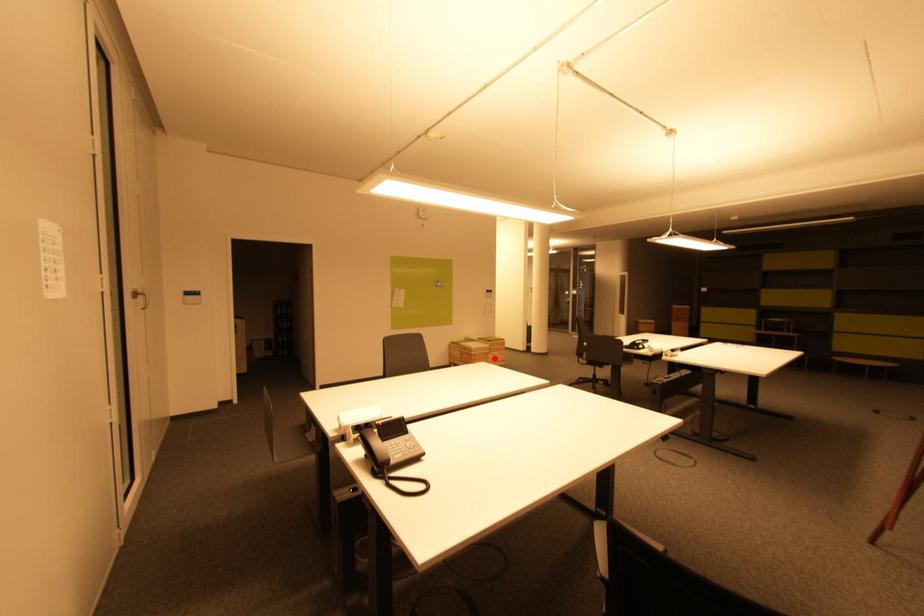
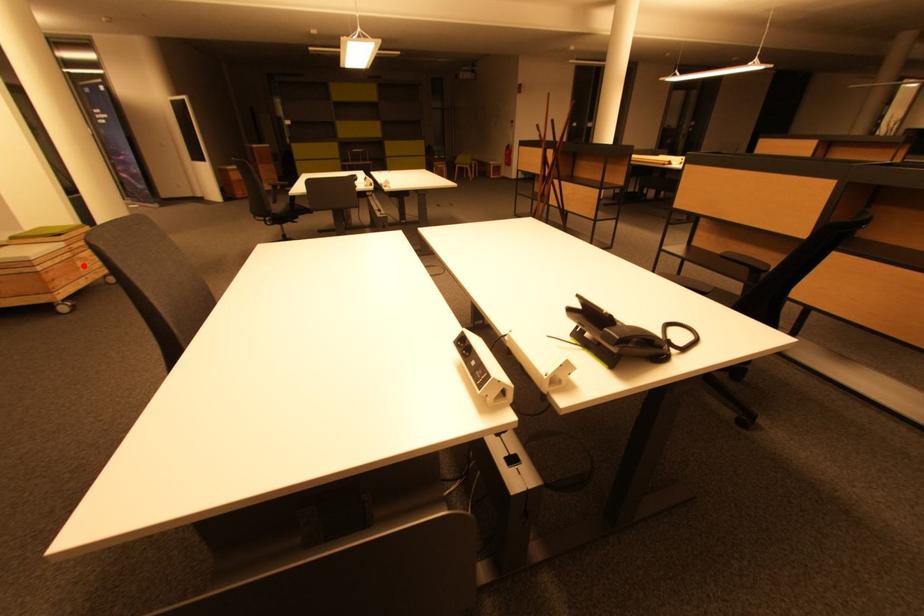
I am providing you with two images of the same scene from different viewpoints. A red point is marked on the first image and another point is marked on the second image. Is the red point in image1 aligned with the point shown in image2?

Yes